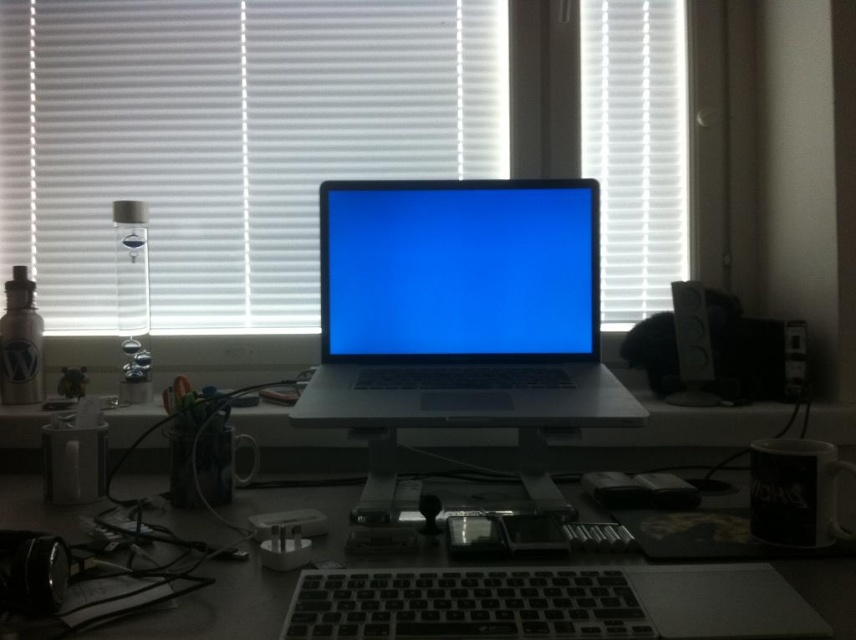
Is sleek silver laptop at center below black plastic keyboard at center?

No.

Who is shorter, sleek silver laptop at center or black plastic keyboard at center?

With less height is black plastic keyboard at center.

Does point (554, 380) lie behind point (176, 618)?

Yes, it is behind point (176, 618).

In order to click on sleek silver laptop at center in this screenshot , I will do `click(461, 307)`.

Between white matte blinds at upper center and black plastic keyboard at center, which one is positioned higher?

Positioned higher is white matte blinds at upper center.

Does white matte blinds at upper center appear on the right side of black plastic keyboard at center?

No, white matte blinds at upper center is not to the right of black plastic keyboard at center.

Describe the element at coordinates (226, 140) in the screenshot. I see `white matte blinds at upper center` at that location.

Where is `white matte blinds at upper center`? The image size is (856, 640). white matte blinds at upper center is located at coordinates (226, 140).

Which of these two, sleek silver laptop at center or white matte blinds at upper right, stands taller?

Standing taller between the two is white matte blinds at upper right.

The height and width of the screenshot is (640, 856). I want to click on sleek silver laptop at center, so [x=461, y=307].